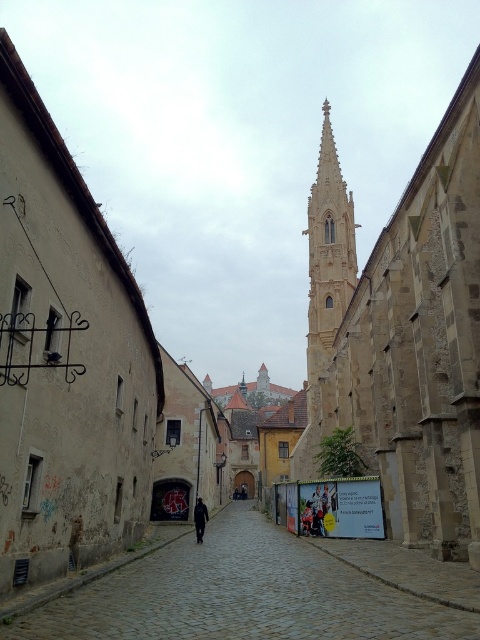
You are standing at the entrance of the cobblestone alley at center. If you walk straight ahead, which direction will you face relative to the church spire in the background?

The cobblestone alley at center is located at point (x=241, y=595) in the image. Since the church spire is in the background, walking straight ahead along the alley would lead you directly towards the church spire.

You are a tourist standing at the entrance of the cobblestone alley at center and want to take a photo of the light beige stone tower at center. Which direction should you face to capture the tower in your shot?

You should face upward to capture the light beige stone tower at center because the cobblestone alley at center is positioned under it.

You are a tourist standing at the entrance of the cobblestone alley at center and want to take a photo of the stone church at left. Which direction should you turn to face the church?

The stone church at left is to the left of the cobblestone alley at center, so you should turn to your left to face the church.